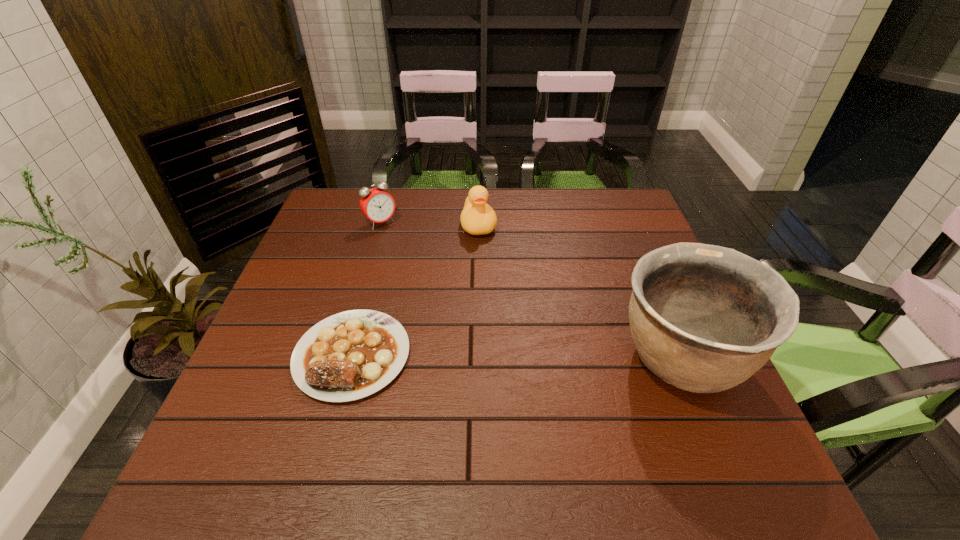
Locate an element on the screen. This screenshot has width=960, height=540. free point between the steak and the alarm clock is located at coordinates (367, 289).

Identify the location of empty space that is in between the rightmost object and the steak. This screenshot has height=540, width=960. (516, 357).

Locate an element on the screen. This screenshot has width=960, height=540. blank region between the duck and the shortest object is located at coordinates (416, 290).

Where is `empty space between the shortest object and the alarm clock`? The image size is (960, 540). empty space between the shortest object and the alarm clock is located at coordinates (367, 289).

You are a GUI agent. You are given a task and a screenshot of the screen. Output one action in this format:
    pyautogui.click(x=<x>, y=<y>)
    Task: Click on the free space that is in between the tallest object and the alarm clock
    The height and width of the screenshot is (540, 960).
    Given the screenshot: What is the action you would take?
    pyautogui.click(x=530, y=291)

Find the location of a particular element. This screenshot has height=540, width=960. empty space between the duck and the pottery is located at coordinates (579, 292).

Find the location of `vacant point located between the alarm clock and the third object from left to right`. vacant point located between the alarm clock and the third object from left to right is located at coordinates (430, 224).

What are the coordinates of `vacant point located between the shortest object and the third object from left to right` in the screenshot? It's located at (416, 290).

The width and height of the screenshot is (960, 540). Find the location of `vacant point located between the alarm clock and the shortest object`. vacant point located between the alarm clock and the shortest object is located at coordinates (367, 289).

This screenshot has height=540, width=960. I want to click on free space between the alarm clock and the pottery, so click(530, 291).